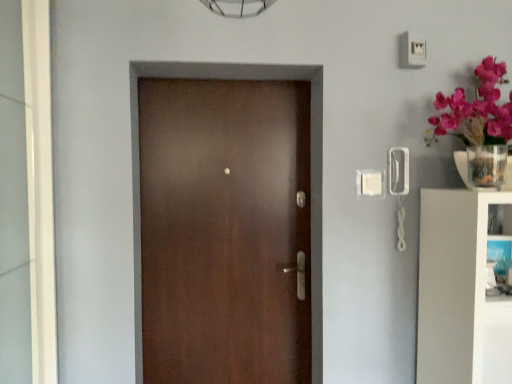
Question: Can you confirm if clear glass vase at upper right is thinner than white glossy bookshelf at right?

Choices:
 (A) no
 (B) yes

Answer: (B)

Question: Does clear glass vase at upper right appear on the left side of white glossy bookshelf at right?

Choices:
 (A) no
 (B) yes

Answer: (B)

Question: Could you tell me if clear glass vase at upper right is facing white glossy bookshelf at right?

Choices:
 (A) no
 (B) yes

Answer: (A)

Question: Considering the relative sizes of clear glass vase at upper right and white glossy bookshelf at right in the image provided, is clear glass vase at upper right bigger than white glossy bookshelf at right?

Choices:
 (A) no
 (B) yes

Answer: (A)

Question: Is clear glass vase at upper right further to camera compared to white glossy bookshelf at right?

Choices:
 (A) yes
 (B) no

Answer: (A)

Question: Relative to satin brown door at center, is white glossy glass door at left in front or behind?

Choices:
 (A) front
 (B) behind

Answer: (A)

Question: From a real-world perspective, relative to satin brown door at center, is white glossy glass door at left vertically above or below?

Choices:
 (A) below
 (B) above

Answer: (B)

Question: Would you say white glossy glass door at left is to the left or to the right of satin brown door at center in the picture?

Choices:
 (A) left
 (B) right

Answer: (A)

Question: From their relative heights in the image, would you say white glossy glass door at left is taller or shorter than satin brown door at center?

Choices:
 (A) tall
 (B) short

Answer: (B)

Question: In terms of width, does satin brown door at center look wider or thinner when compared to clear glass vase at upper right?

Choices:
 (A) thin
 (B) wide

Answer: (A)

Question: In the image, is satin brown door at center positioned in front of or behind clear glass vase at upper right?

Choices:
 (A) behind
 (B) front

Answer: (A)

Question: From the image's perspective, relative to clear glass vase at upper right, is satin brown door at center above or below?

Choices:
 (A) below
 (B) above

Answer: (A)

Question: Considering the positions of point (189, 137) and point (498, 170), is point (189, 137) closer or farther from the camera than point (498, 170)?

Choices:
 (A) closer
 (B) farther

Answer: (B)

Question: Is point coord(472,173) closer or farther from the camera than point coord(192,120)?

Choices:
 (A) closer
 (B) farther

Answer: (A)

Question: From a real-world perspective, is clear glass vase at upper right above or below satin brown door at center?

Choices:
 (A) above
 (B) below

Answer: (A)